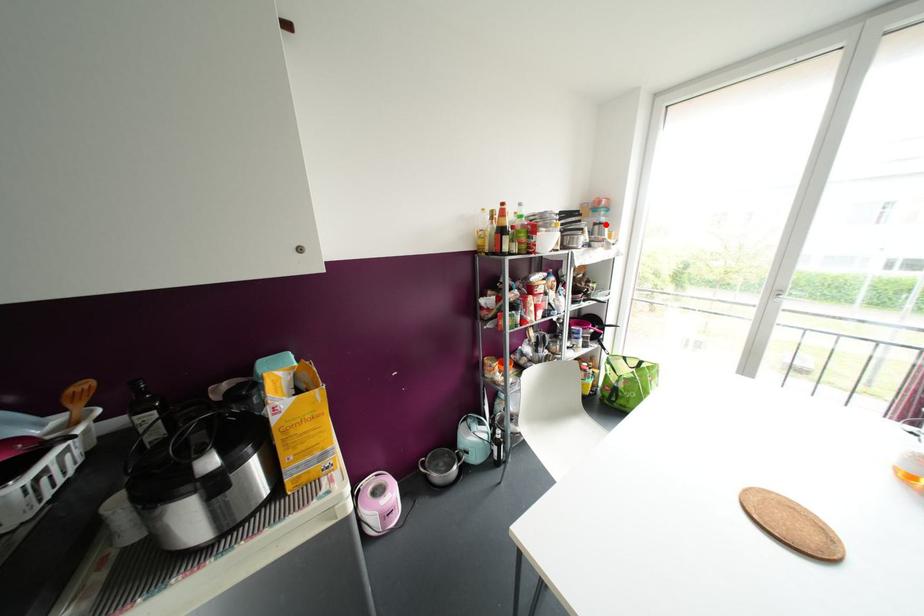
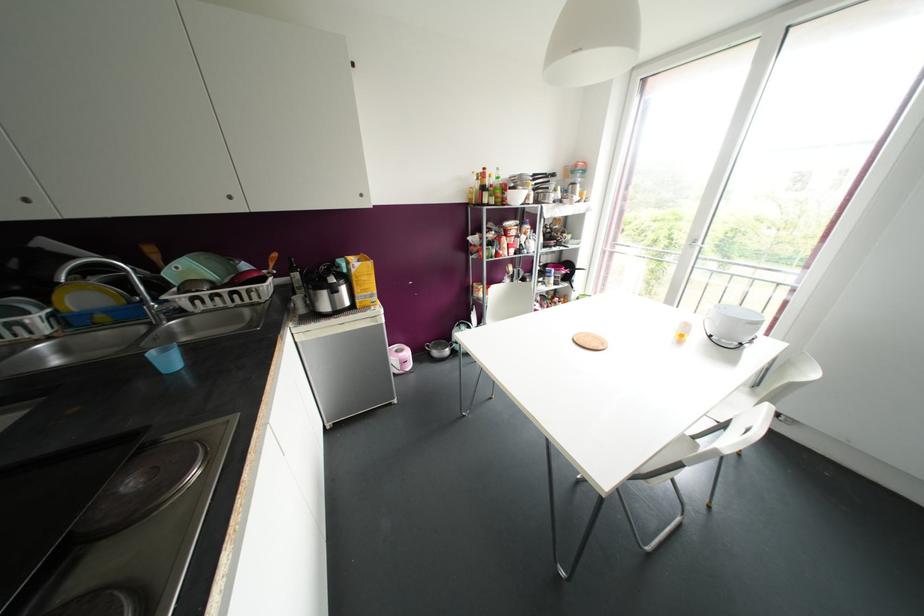
Locate, in the second image, the point that corresponds to the highlighted location in the first image.

(578, 185)